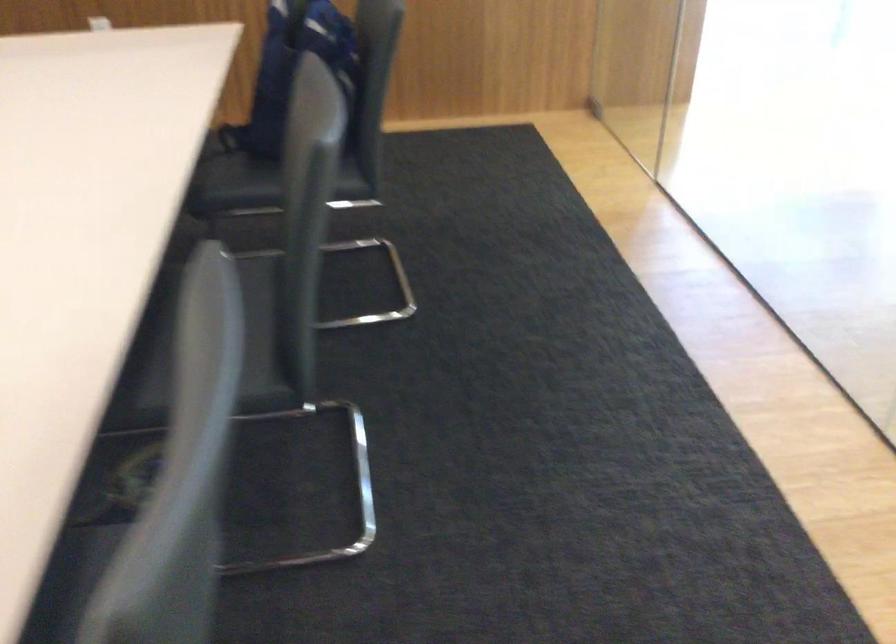
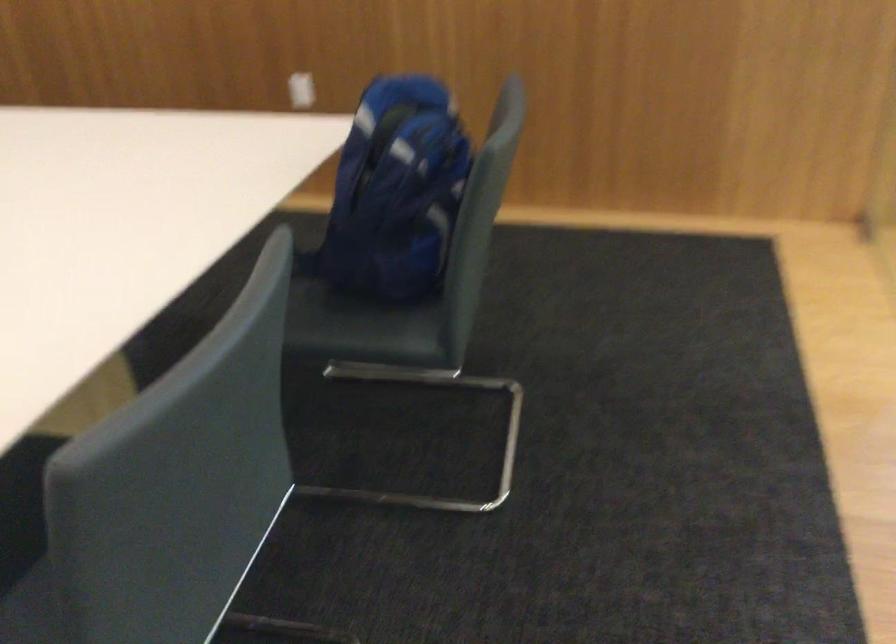
Find the pixel in the second image that matches the point at 256,169 in the first image.

(323, 308)